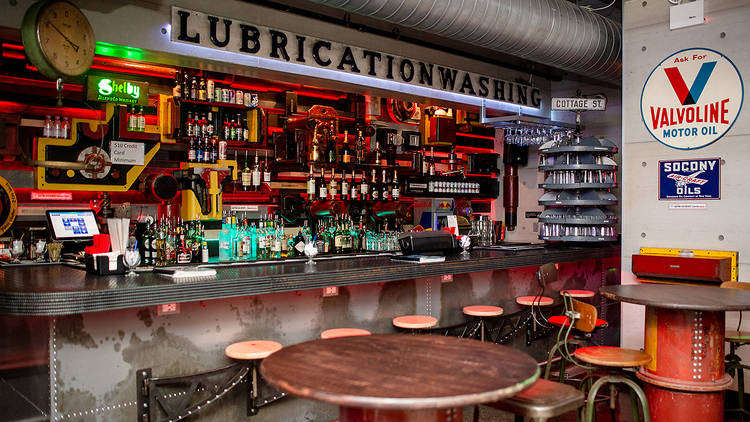
This screenshot has width=750, height=422. What are the coordinates of `scale hanging from wall` in the screenshot? It's located at (58, 33).